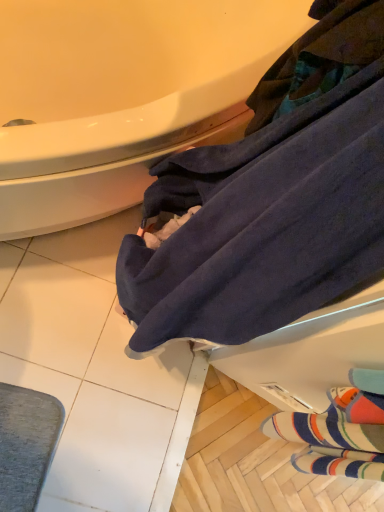
In order to click on white glossy bathtub at upper left in this screenshot , I will do `click(120, 95)`.

Find the location of a particular element. The height and width of the screenshot is (512, 384). white glossy bathtub at upper left is located at coordinates (120, 95).

Relative to white glossy bathtub at upper left, is striped wool socks at lower right in front or behind?

striped wool socks at lower right is positioned farther from the viewer than white glossy bathtub at upper left.

I want to click on bathtub above the striped wool socks at lower right (from the image's perspective), so click(x=120, y=95).

Is striped wool socks at lower right bigger or smaller than white glossy bathtub at upper left?

striped wool socks at lower right is smaller than white glossy bathtub at upper left.

From the image's perspective, is striped wool socks at lower right above white glossy bathtub at upper left?

No.

Based on their sizes in the image, would you say white glossy bathtub at upper left is bigger or smaller than striped wool socks at lower right?

Considering their sizes, white glossy bathtub at upper left takes up more space than striped wool socks at lower right.

Does point (229, 128) come closer to viewer compared to point (196, 470)?

Yes, it is.

Considering the relative positions of white glossy bathtub at upper left and striped wool socks at lower right in the image provided, is white glossy bathtub at upper left in front of striped wool socks at lower right?

Yes, it is.

The width and height of the screenshot is (384, 512). I want to click on tile that is behind the white glossy bathtub at upper left, so [x=254, y=462].

Does dark blue towel at lower right turn towards white glossy bathtub at upper left?

No.

Would you say dark blue towel at lower right is to the left or to the right of white glossy bathtub at upper left in the picture?

In the image, dark blue towel at lower right appears on the right side of white glossy bathtub at upper left.

From a real-world perspective, which object rests below the other?

In real-world perspective, white glossy bathtub at upper left is lower.

From the image's perspective, between dark blue towel at lower right and white glossy bathtub at upper left, who is located below?

dark blue towel at lower right.

Is striped wool socks at lower right thinner than dark blue towel at lower right?

Indeed, striped wool socks at lower right has a lesser width compared to dark blue towel at lower right.

Considering the relative sizes of striped wool socks at lower right and dark blue towel at lower right in the image provided, is striped wool socks at lower right bigger than dark blue towel at lower right?

Actually, striped wool socks at lower right might be smaller than dark blue towel at lower right.

From a real-world perspective, is striped wool socks at lower right on top of dark blue towel at lower right?

No.

Can you confirm if dark blue towel at lower right is taller than striped wool socks at lower right?

Correct, dark blue towel at lower right is much taller as striped wool socks at lower right.

Considering the points (143, 244) and (222, 471), which point is behind, point (143, 244) or point (222, 471)?

The point (222, 471) is farther from the camera.

Can you confirm if dark blue towel at lower right is bigger than striped wool socks at lower right?

Yes.

From a real-world perspective, is dark blue towel at lower right below striped wool socks at lower right?

No.

From the image's perspective, does white glossy bathtub at upper left appear lower than dark blue towel at lower right?

No.

Is white glossy bathtub at upper left facing towards dark blue towel at lower right?

No, white glossy bathtub at upper left is not oriented towards dark blue towel at lower right.

Can you tell me how much white glossy bathtub at upper left and dark blue towel at lower right differ in facing direction?

The facing directions of white glossy bathtub at upper left and dark blue towel at lower right are 87.3 degrees apart.

Is white glossy bathtub at upper left at the right side of dark blue towel at lower right?

In fact, white glossy bathtub at upper left is to the left of dark blue towel at lower right.

Where is `tile below the white glossy bathtub at upper left (from the image's perspective)`? tile below the white glossy bathtub at upper left (from the image's perspective) is located at coordinates (254, 462).

At what (x,y) coordinates should I click in order to perform the action: click on bathtub located in front of the striped wool socks at lower right. Please return your answer as a coordinate pair (x, y). Looking at the image, I should click on (120, 95).

Estimate the real-world distances between objects in this image. Which object is closer to white glossy bathtub at upper left, striped wool socks at lower right or dark blue towel at lower right?

Among the two, dark blue towel at lower right is located nearer to white glossy bathtub at upper left.

Which object lies further to the anchor point dark blue towel at lower right, striped wool socks at lower right or white glossy bathtub at upper left?

Among the two, striped wool socks at lower right is located further to dark blue towel at lower right.

Looking at the image, which one is located closer to striped wool socks at lower right, white glossy bathtub at upper left or dark blue towel at lower right?

Among the two, dark blue towel at lower right is located nearer to striped wool socks at lower right.

From the image, which object appears to be nearer to white glossy bathtub at upper left, dark blue towel at lower right or striped wool socks at lower right?

dark blue towel at lower right.

In the scene shown: When comparing their distances from striped wool socks at lower right, does dark blue towel at lower right or white glossy bathtub at upper left seem further?

white glossy bathtub at upper left is positioned further to the anchor striped wool socks at lower right.

Which object lies further to the anchor point dark blue towel at lower right, white glossy bathtub at upper left or striped wool socks at lower right?

The object further to dark blue towel at lower right is striped wool socks at lower right.

Identify the location of bath towel between white glossy bathtub at upper left and striped wool socks at lower right in the vertical direction. (263, 223).